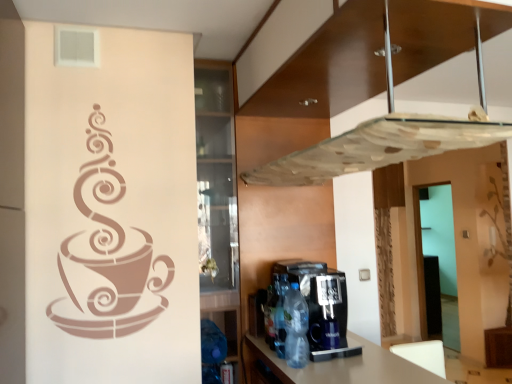
Question: From the image's perspective, is transparent glass door at right below translucent plastic bottle at center, which appears as the third bottle when viewed from the front?

Choices:
 (A) no
 (B) yes

Answer: (B)

Question: From a real-world perspective, is transparent glass door at right over translucent plastic bottle at center, which ranks as the 1th bottle in back-to-front order?

Choices:
 (A) yes
 (B) no

Answer: (B)

Question: Is translucent plastic bottle at center, which appears as the third bottle when viewed from the front, at the back of transparent glass door at right?

Choices:
 (A) no
 (B) yes

Answer: (A)

Question: Is the depth of transparent glass door at right greater than that of translucent plastic bottle at center, which ranks as the 1th bottle in back-to-front order?

Choices:
 (A) yes
 (B) no

Answer: (A)

Question: From a real-world perspective, is transparent glass door at right physically below translucent plastic bottle at center, which appears as the third bottle when viewed from the front?

Choices:
 (A) no
 (B) yes

Answer: (B)

Question: In terms of width, does translucent plastic bottle at center, which ranks as the 2th bottle in back-to-front order, look wider or thinner when compared to transparent glass exhaust hood at upper center?

Choices:
 (A) thin
 (B) wide

Answer: (A)

Question: From a real-world perspective, is translucent plastic bottle at center, which ranks as the 2th bottle in back-to-front order, above or below transparent glass exhaust hood at upper center?

Choices:
 (A) below
 (B) above

Answer: (A)

Question: Is translucent plastic bottle at center, which ranks as the 2th bottle in front-to-back order, inside or outside of transparent glass exhaust hood at upper center?

Choices:
 (A) inside
 (B) outside

Answer: (B)

Question: Looking at the image, does translucent plastic bottle at center, which ranks as the 2th bottle in back-to-front order, seem bigger or smaller compared to transparent glass exhaust hood at upper center?

Choices:
 (A) big
 (B) small

Answer: (B)

Question: Is translucent plastic bottle at center, which ranks as the 1th bottle in back-to-front order, situated inside transparent glass door at right or outside?

Choices:
 (A) outside
 (B) inside

Answer: (A)

Question: From a real-world perspective, is translucent plastic bottle at center, which appears as the third bottle when viewed from the front, above or below transparent glass door at right?

Choices:
 (A) above
 (B) below

Answer: (A)

Question: Does point (264, 316) appear closer or farther from the camera than point (421, 235)?

Choices:
 (A) farther
 (B) closer

Answer: (B)

Question: From their relative heights in the image, would you say translucent plastic bottle at center, which ranks as the 1th bottle in back-to-front order, is taller or shorter than transparent glass door at right?

Choices:
 (A) tall
 (B) short

Answer: (B)

Question: Is transparent glass exhaust hood at upper center wider or thinner than black plastic coffee machine at lower center?

Choices:
 (A) thin
 (B) wide

Answer: (B)

Question: In the image, is transparent glass exhaust hood at upper center positioned in front of or behind black plastic coffee machine at lower center?

Choices:
 (A) behind
 (B) front

Answer: (B)